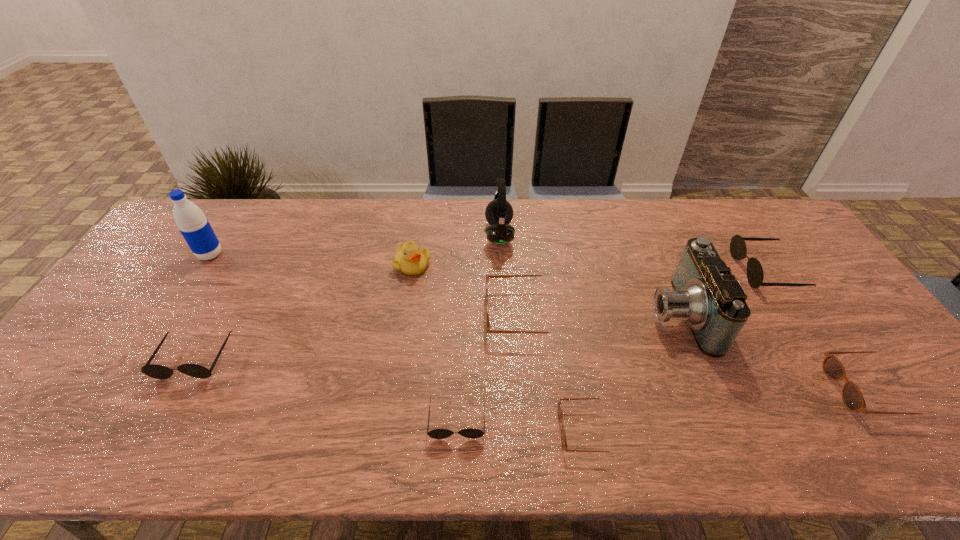
Image resolution: width=960 pixels, height=540 pixels. In order to click on black sunglasses object that ranks as the closest to the water bottle in this screenshot , I will do `click(155, 371)`.

Select which brown sunglasses appears as the second closest to the rightmost brown sunglasses. Please provide its 2D coordinates. Your answer should be formatted as a tuple, i.e. [(x, y)], where the tuple contains the x and y coordinates of a point satisfying the conditions above.

[(488, 330)]

The width and height of the screenshot is (960, 540). I want to click on brown sunglasses that stands as the second closest to the leftmost object, so click(x=563, y=434).

Locate an element on the screen. The height and width of the screenshot is (540, 960). free location that satisfies the following two spatial constraints: 1. on the front-facing side of the third object from right to left; 2. on the front-facing side of the leftmost black sunglasses is located at coordinates point(697,359).

Locate an element on the screen. The height and width of the screenshot is (540, 960). vacant region that satisfies the following two spatial constraints: 1. on the ear cups of the black headset; 2. on the front-facing side of the fourth object from left to right is located at coordinates (508, 420).